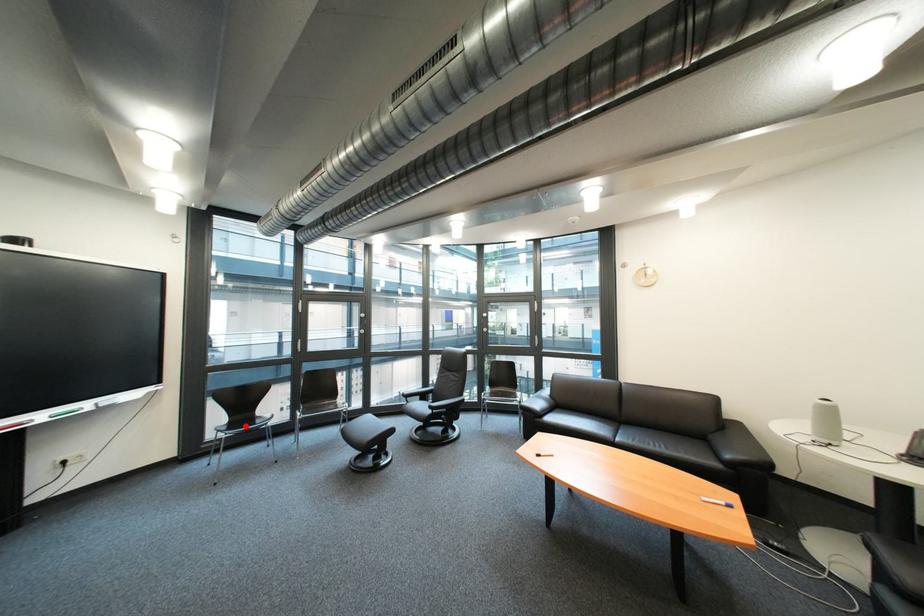
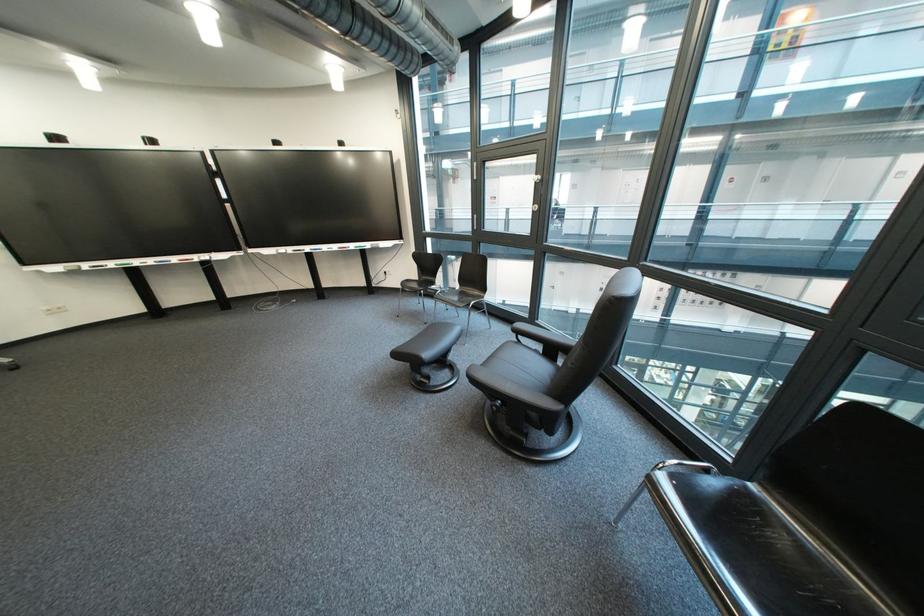
In the second image, find the point that corresponds to the highlighted location in the first image.

(435, 284)